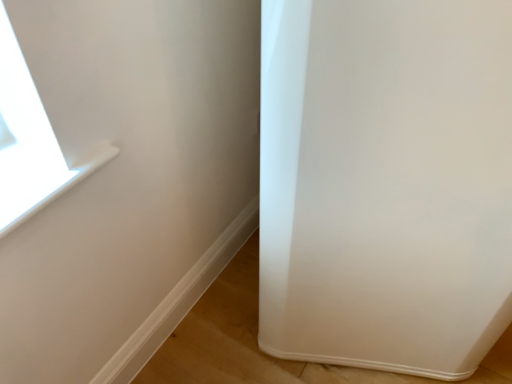
This screenshot has width=512, height=384. Find the location of `white glossy screen door at lower right`. white glossy screen door at lower right is located at coordinates (386, 183).

Describe the element at coordinates (386, 183) in the screenshot. The height and width of the screenshot is (384, 512). I see `white glossy screen door at lower right` at that location.

Locate an element on the screen. The image size is (512, 384). white glossy screen door at lower right is located at coordinates (386, 183).